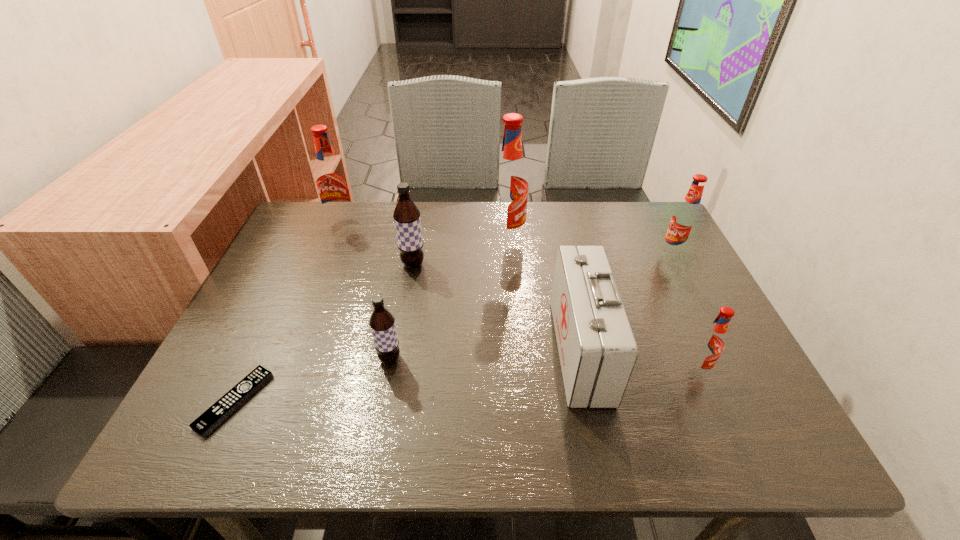
Where is `free space located 0.050m on the back of the smaller brown root beer`? free space located 0.050m on the back of the smaller brown root beer is located at coordinates (395, 332).

At what (x,y) coordinates should I click in order to perform the action: click on blank space located on the left of the third red root beer from left to right. Please return your answer as a coordinate pair (x, y). This screenshot has width=960, height=540. Looking at the image, I should click on (504, 370).

At what (x,y) coordinates should I click in order to perform the action: click on vacant space located on the back of the remote control. Please return your answer as a coordinate pair (x, y). Looking at the image, I should click on (295, 274).

Locate an element on the screen. the first-aid kit that is at the near edge is located at coordinates (597, 349).

Identify the location of remote control located in the near edge section of the desktop. (234, 398).

Identify the location of root beer at the left edge. This screenshot has height=540, width=960. tap(331, 181).

You are a GUI agent. You are given a task and a screenshot of the screen. Output one action in this format:
    pyautogui.click(x=<x>, y=<y>)
    Task: Click on the remote control that is at the left edge
    This screenshot has height=540, width=960.
    Given the screenshot: What is the action you would take?
    pyautogui.click(x=234, y=398)

Identify the location of object located at the far left corner. (331, 181).

Identify the location of object at the near left corner. [x=234, y=398].

Find the location of a particular element. object positioned at the far right corner is located at coordinates (685, 219).